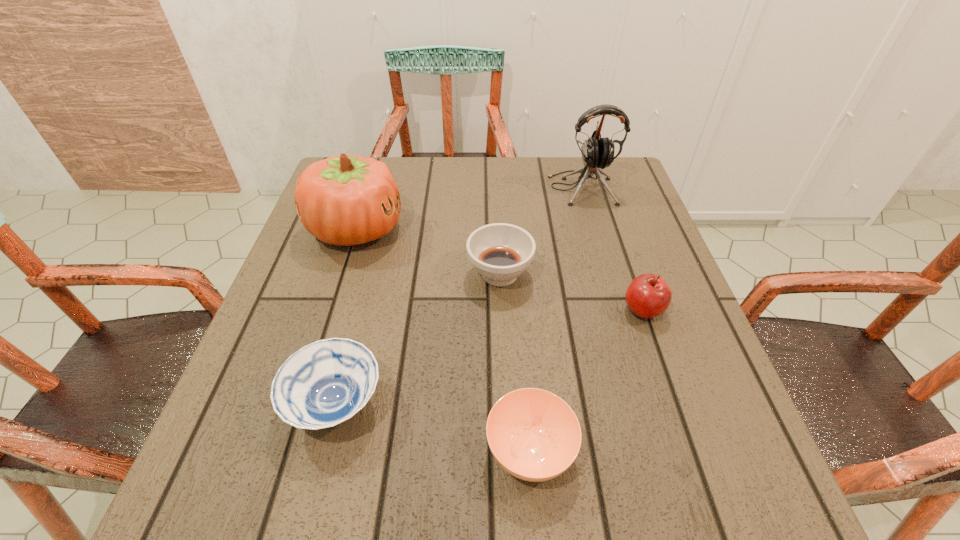
In order to click on vacant space at the near edge in this screenshot , I will do `click(454, 485)`.

Image resolution: width=960 pixels, height=540 pixels. What are the coordinates of `free space at the left edge of the desktop` in the screenshot? It's located at (238, 440).

The image size is (960, 540). What are the coordinates of `free space at the right edge` in the screenshot? It's located at (619, 247).

Where is `blank space at the near left corner of the desktop`? blank space at the near left corner of the desktop is located at coordinates (258, 485).

Find the location of a particular element. free spot between the leftmost soup bowl and the apple is located at coordinates (490, 357).

This screenshot has height=540, width=960. Find the location of `free spot between the leftmost soup bowl and the earphone`. free spot between the leftmost soup bowl and the earphone is located at coordinates (459, 296).

The width and height of the screenshot is (960, 540). I want to click on unoccupied area between the leftmost soup bowl and the second tallest object, so click(347, 316).

You are a GUI agent. You are given a task and a screenshot of the screen. Output one action in this format:
    pyautogui.click(x=<x>, y=<y>)
    Task: Click on the free area in between the leftmost soup bowl and the earphone
    
    Given the screenshot: What is the action you would take?
    pyautogui.click(x=459, y=296)

The height and width of the screenshot is (540, 960). What are the coordinates of `empty location between the leftmost soup bowl and the second tallest object` in the screenshot? It's located at (347, 316).

Identify the location of vacant space in between the pumpkin and the earphone. (468, 208).